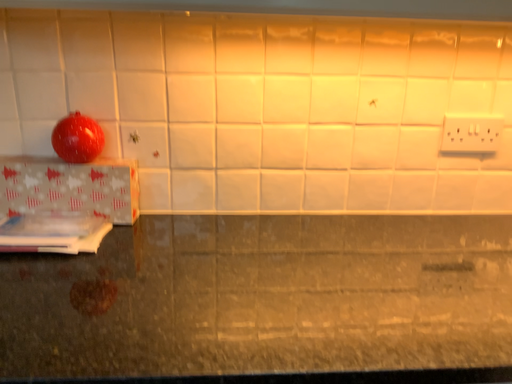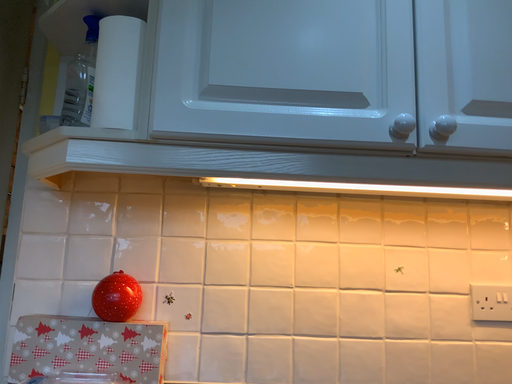
Question: Which way did the camera rotate in the video?

Choices:
 (A) rotated upward
 (B) rotated downward

Answer: (A)